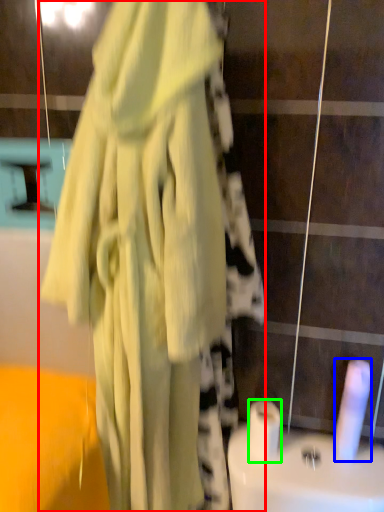
Question: Which object is the farthest from fancy dress (highlighted by a red box)? Choose among these: toilet paper (highlighted by a blue box) or toilet paper (highlighted by a green box).

Choices:
 (A) toilet paper
 (B) toilet paper

Answer: (A)